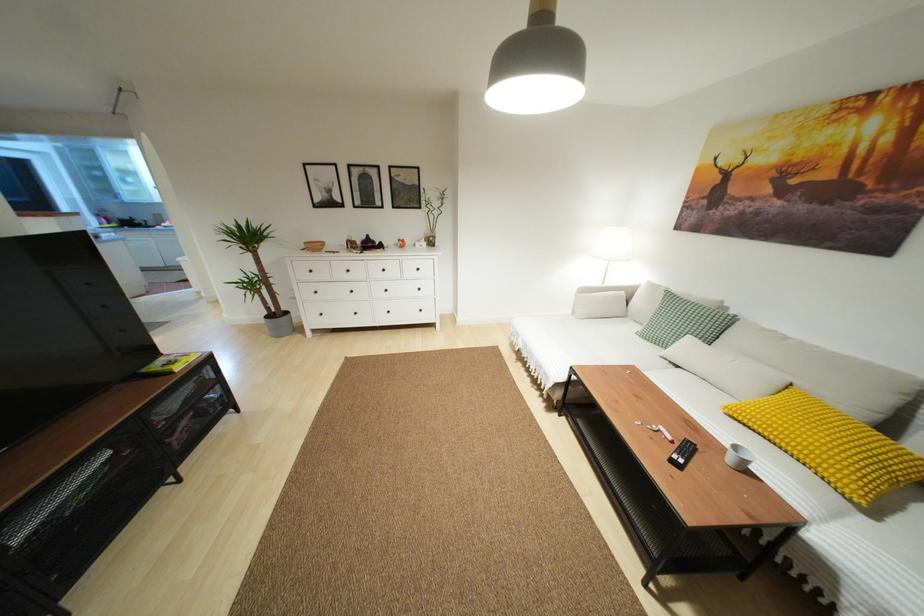
Find where to sit the sofa sitting surface. Please return your answer as a coordinate pair (x, y).

(594, 339)